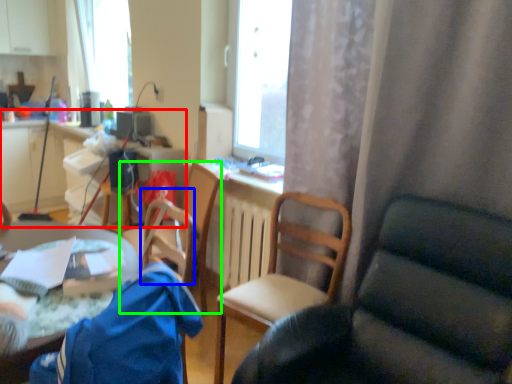
Question: Which object is positioned closest to computer desk (highlighted by a red box)? Select from armchair (highlighted by a blue box) and chair (highlighted by a green box).

Choices:
 (A) armchair
 (B) chair

Answer: (B)